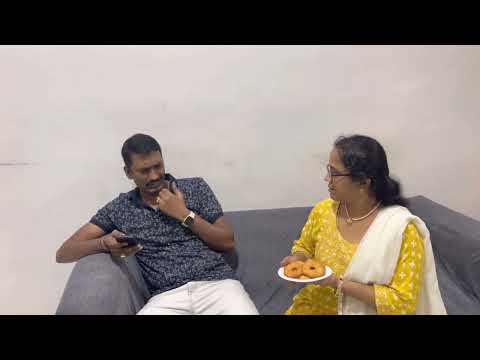
The width and height of the screenshot is (480, 360). I want to click on phone, so click(132, 241).